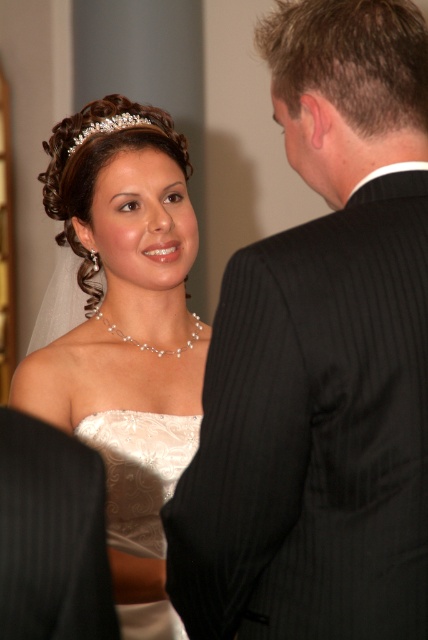
Question: Is white satin dress at center positioned behind clear crystal tiara at upper center?

Choices:
 (A) no
 (B) yes

Answer: (A)

Question: Can you confirm if white lace dress at center is positioned above clear crystal tiara at upper center?

Choices:
 (A) yes
 (B) no

Answer: (B)

Question: Which point is closer to the camera?

Choices:
 (A) pos(142,116)
 (B) pos(139,512)
 (C) pos(165,544)

Answer: (B)

Question: Is white satin dress at center thinner than white lace dress at center?

Choices:
 (A) yes
 (B) no

Answer: (B)

Question: Which object appears farthest from the camera in this image?

Choices:
 (A) black pinstripe suit at right
 (B) white satin dress at center

Answer: (B)

Question: Which point is farther to the camera?

Choices:
 (A) white lace dress at center
 (B) clear crystal tiara at upper center
 (C) white satin dress at center
 (D) black pinstripe suit at right

Answer: (B)